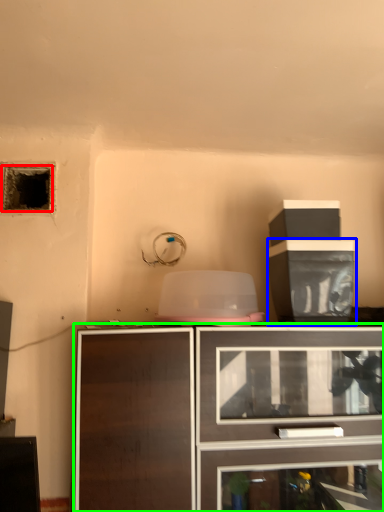
Question: Estimate the real-world distances between objects in this image. Which object is closer to hole (highlighted by a red box), cabinetry (highlighted by a blue box) or cabinetry (highlighted by a green box)?

Choices:
 (A) cabinetry
 (B) cabinetry

Answer: (A)